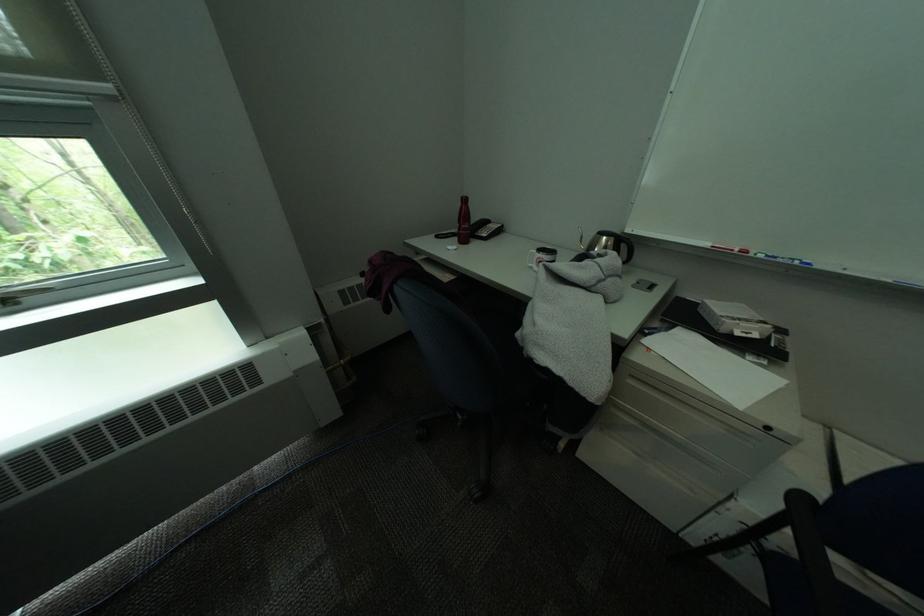
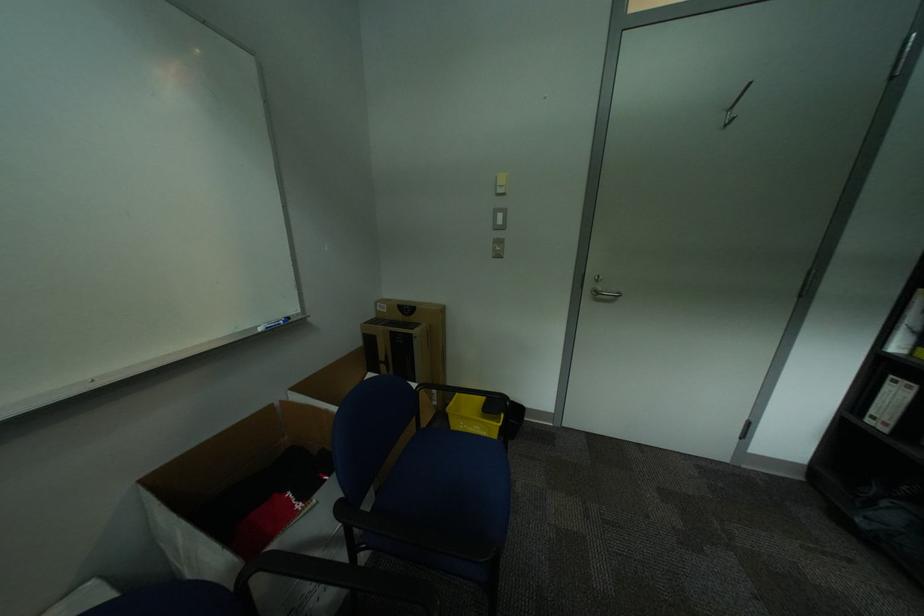
Based on the continuous images, in which direction is the camera rotating?

The camera's rotation is toward right-down.